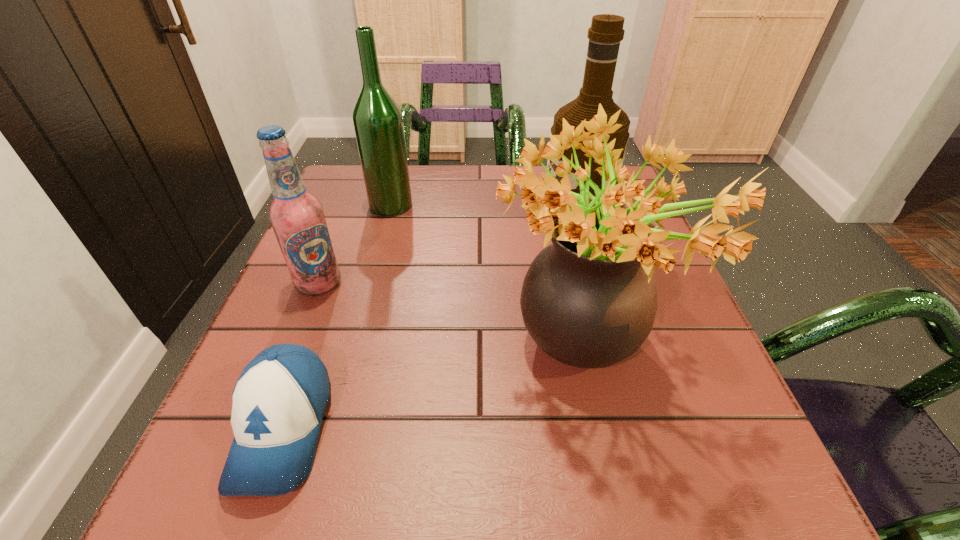
Identify the location of the rightmost alcohol. (606, 32).

I want to click on the second alcohol from right to left, so click(377, 119).

Locate an element on the screen. This screenshot has width=960, height=540. flower arrangement is located at coordinates (589, 300).

You are a GUI agent. You are given a task and a screenshot of the screen. Output one action in this format:
    pyautogui.click(x=<x>, y=<y>)
    Task: Click on the nearest alcohol
    
    Given the screenshot: What is the action you would take?
    pyautogui.click(x=297, y=217)

Locate an element on the screen. the shortest alcohol is located at coordinates (297, 217).

Image resolution: width=960 pixels, height=540 pixels. I want to click on the shortest object, so click(279, 400).

In order to click on vacant space located 0.350m on the label of the rightmost alcohol in this screenshot , I will do `click(393, 215)`.

Locate an element on the screen. The height and width of the screenshot is (540, 960). vacant space situated on the label of the rightmost alcohol is located at coordinates (483, 215).

I want to click on free point located 0.090m on the label of the rightmost alcohol, so click(504, 215).

This screenshot has height=540, width=960. In order to click on free space located on the back of the second alcohol from right to left in this screenshot , I will do `click(399, 176)`.